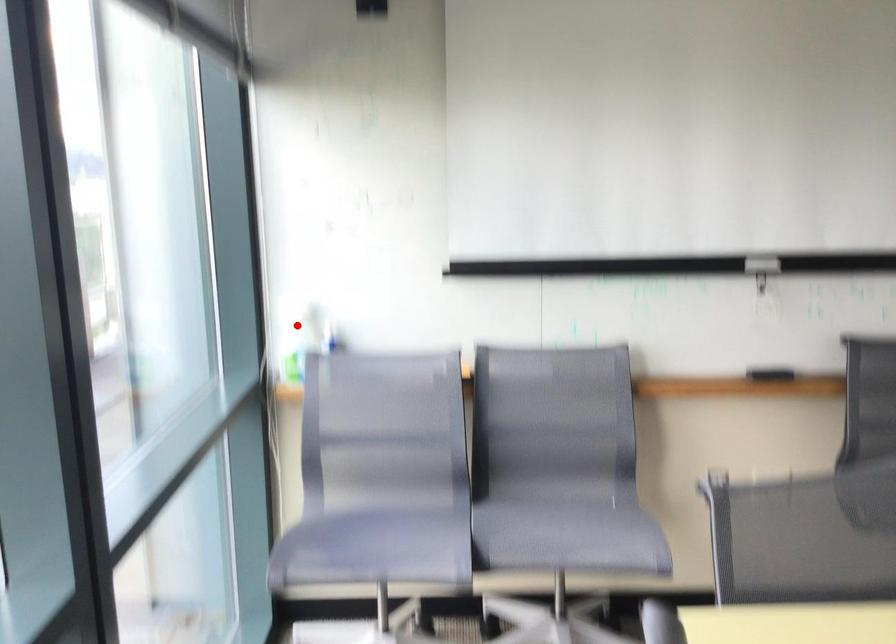
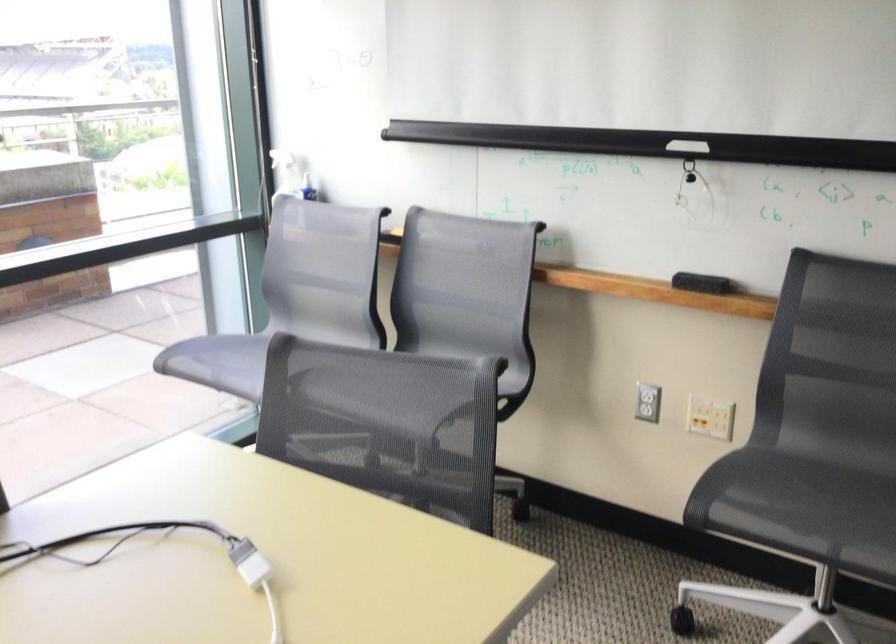
Question: I am providing you with two images of the same scene from different viewpoints. A red point is shown in image1. For the corresponding object point in image2, is it positioned nearer or farther from the camera?

Choices:
 (A) Nearer
 (B) Farther

Answer: (B)